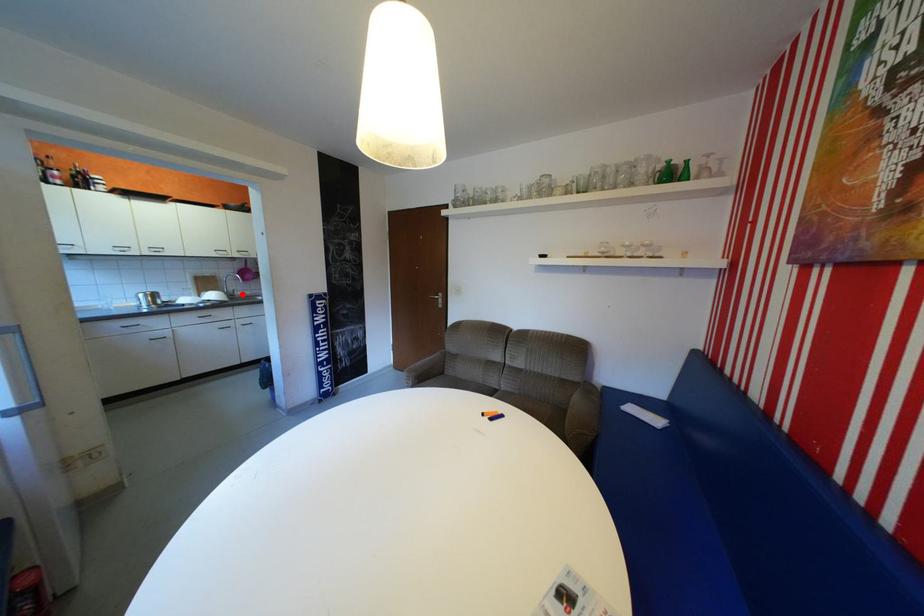
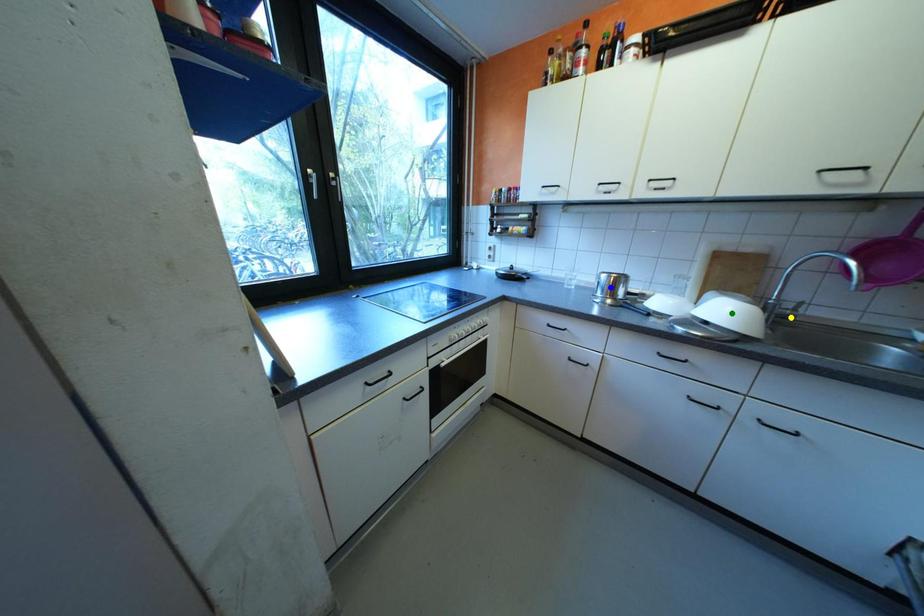
Question: I am providing you with two images of the same scene from different viewpoints. A red point is marked on the first image. You are given multiple points on the second image. Which point in image 2 is actually the same real-world point as the red point in image 1?

Choices:
 (A) blue point
 (B) green point
 (C) yellow point

Answer: (C)